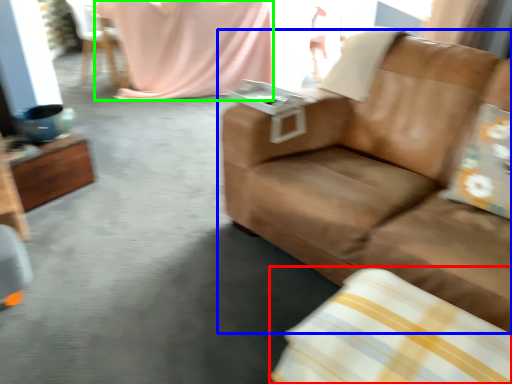
Question: Considering the real-world distances, which object is farthest from pillow (highlighted by a red box)? studio couch (highlighted by a blue box) or blanket (highlighted by a green box)?

Choices:
 (A) studio couch
 (B) blanket

Answer: (B)